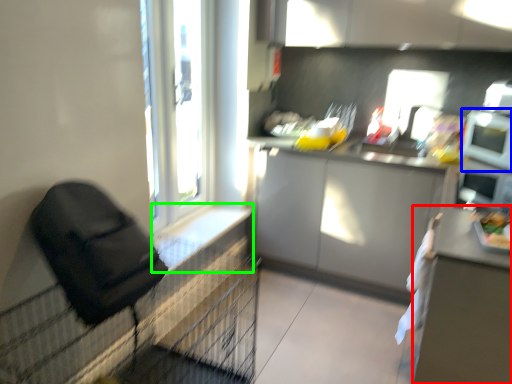
Question: Which object is the closest to the table (highlighted by a red box)? Choose among these: appliance (highlighted by a blue box) or window sill (highlighted by a green box).

Choices:
 (A) appliance
 (B) window sill

Answer: (A)